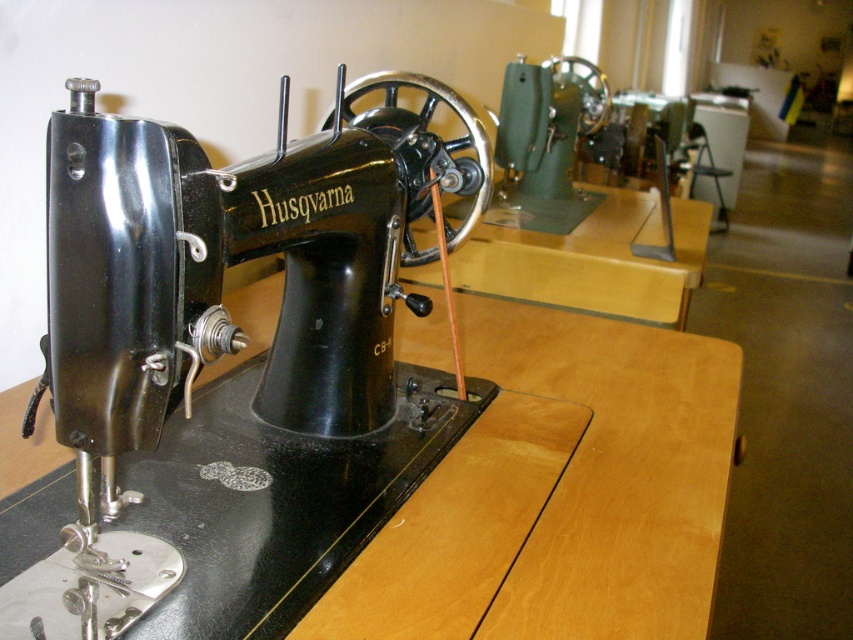
Question: Which of the following is the farthest from the observer?

Choices:
 (A) wooden table at center
 (B) black metal sewing machine at center

Answer: (A)

Question: Considering the relative positions of black metal sewing machine at center and wooden table at center in the image provided, where is black metal sewing machine at center located with respect to wooden table at center?

Choices:
 (A) right
 (B) left

Answer: (B)

Question: Is black metal sewing machine at center smaller than wooden table at center?

Choices:
 (A) no
 (B) yes

Answer: (B)

Question: Is black metal sewing machine at center below wooden table at center?

Choices:
 (A) yes
 (B) no

Answer: (B)

Question: Which of the following is the farthest from the observer?

Choices:
 (A) wooden table at center
 (B) black metal sewing machine at center

Answer: (A)